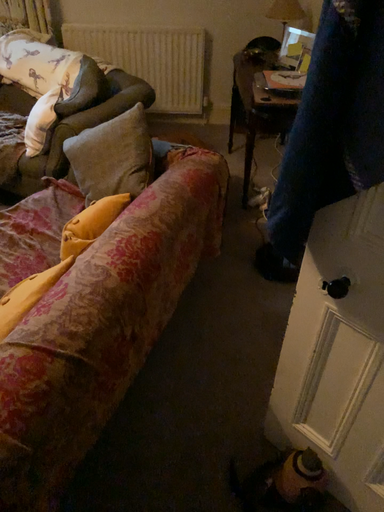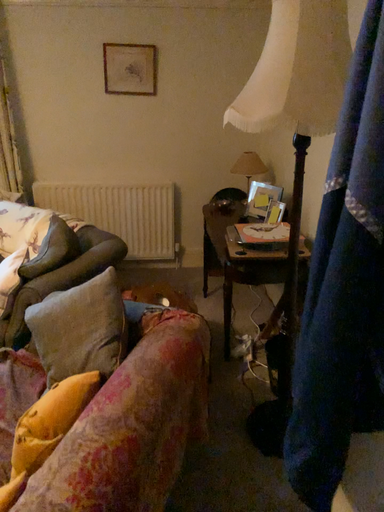
Question: Which way did the camera rotate in the video?

Choices:
 (A) rotated upward
 (B) rotated downward

Answer: (A)